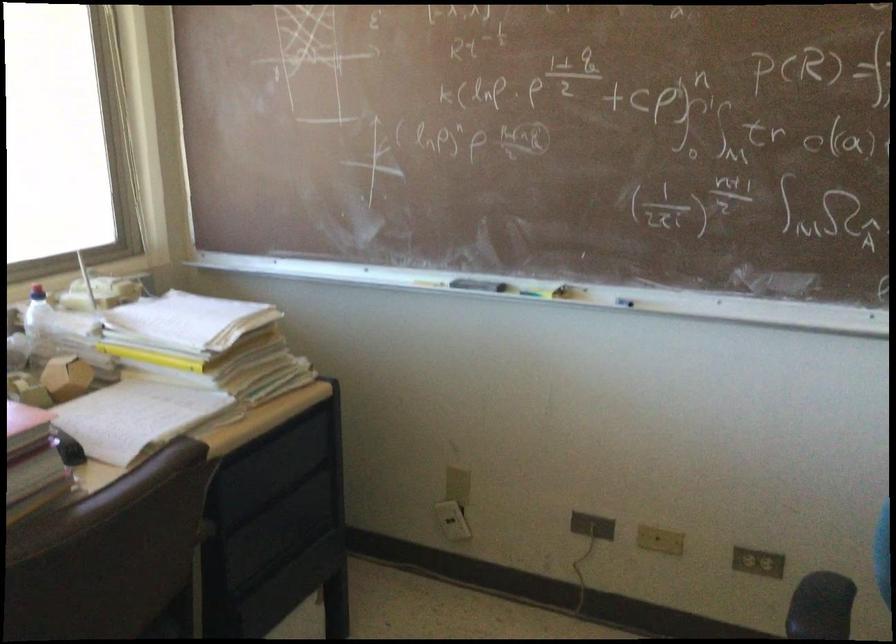
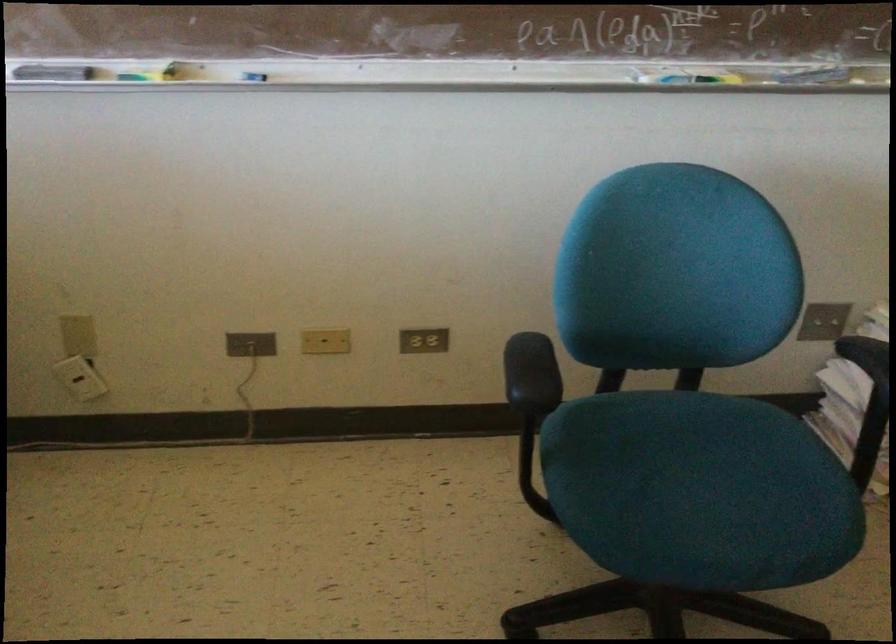
Find the pixel in the second image that matches point 659,541 in the first image.

(325, 341)